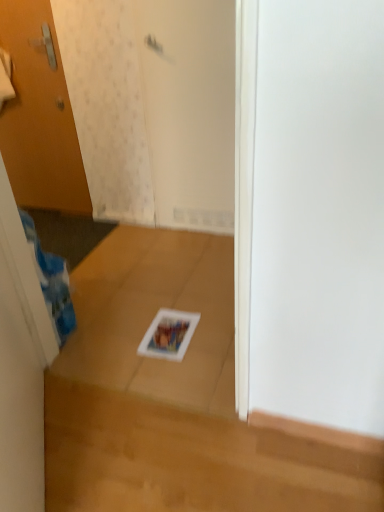
Question: Considering the positions of white matte screen door at upper center and wooden door at left in the image, is white matte screen door at upper center taller or shorter than wooden door at left?

Choices:
 (A) short
 (B) tall

Answer: (A)

Question: Is white matte screen door at upper center inside or outside of wooden door at left?

Choices:
 (A) outside
 (B) inside

Answer: (A)

Question: Based on their relative distances, which object is nearer to the white matte screen door at upper center?

Choices:
 (A) matte white magazine at center
 (B) wooden door at left

Answer: (B)

Question: Which of these objects is positioned farthest from the matte white magazine at center?

Choices:
 (A) wooden door at left
 (B) white matte screen door at upper center

Answer: (A)